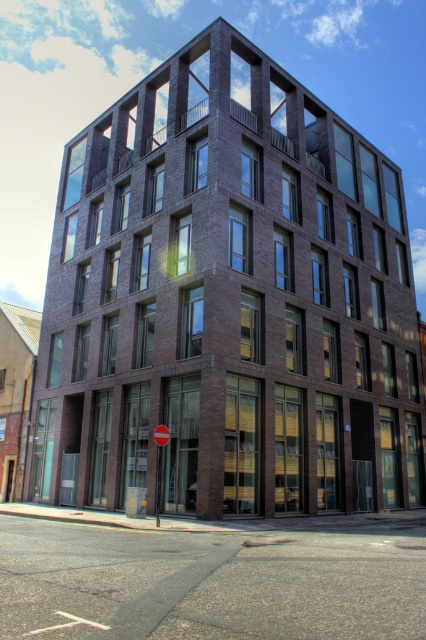
Question: In this image, where is yellow plastic street sign at lower center located relative to red glossy circle at center?

Choices:
 (A) right
 (B) left

Answer: (A)

Question: Which object appears farthest from the camera in this image?

Choices:
 (A) red glossy circle at center
 (B) yellow plastic street sign at lower center

Answer: (A)

Question: Does yellow plastic street sign at lower center appear under red glossy circle at center?

Choices:
 (A) yes
 (B) no

Answer: (B)

Question: Is yellow plastic street sign at lower center closer to camera compared to red glossy circle at center?

Choices:
 (A) no
 (B) yes

Answer: (B)